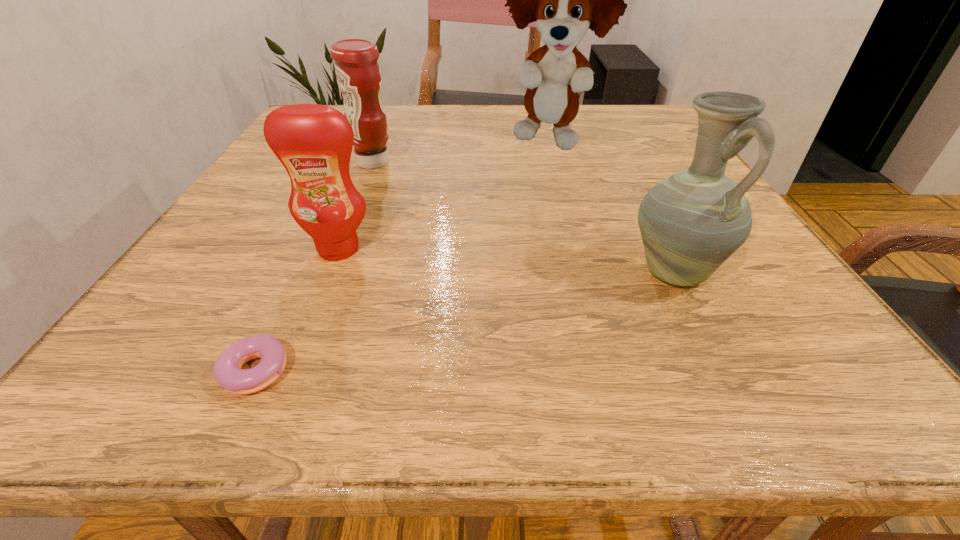
In the image, there is a desktop. At what (x,y) coordinates should I click in order to perform the action: click on vacant space at the near left corner. Please return your answer as a coordinate pair (x, y). This screenshot has width=960, height=540. Looking at the image, I should click on (202, 386).

Where is `free space at the far right corner of the desktop`? free space at the far right corner of the desktop is located at coordinates (607, 126).

Locate an element on the screen. The width and height of the screenshot is (960, 540). empty location between the puppy and the pitcher is located at coordinates (611, 207).

This screenshot has width=960, height=540. Find the location of `unoccupied area between the tallest object and the farther condiment`. unoccupied area between the tallest object and the farther condiment is located at coordinates (461, 152).

At what (x,y) coordinates should I click in order to perform the action: click on vacant point located between the puppy and the shortest object. Please return your answer as a coordinate pair (x, y). This screenshot has width=960, height=540. Looking at the image, I should click on (403, 256).

Image resolution: width=960 pixels, height=540 pixels. What are the coordinates of `empty space that is in between the nearest object and the pitcher` in the screenshot? It's located at (467, 322).

Locate an element on the screen. free area in between the shortest object and the farther condiment is located at coordinates pyautogui.click(x=316, y=267).

Image resolution: width=960 pixels, height=540 pixels. What are the coordinates of `empty location between the pitcher and the nearest object` in the screenshot? It's located at (467, 322).

Image resolution: width=960 pixels, height=540 pixels. Identify the location of free space between the farther condiment and the pitcher. (523, 217).

This screenshot has height=540, width=960. What are the coordinates of `empty space between the nearest object and the pitcher` in the screenshot? It's located at (467, 322).